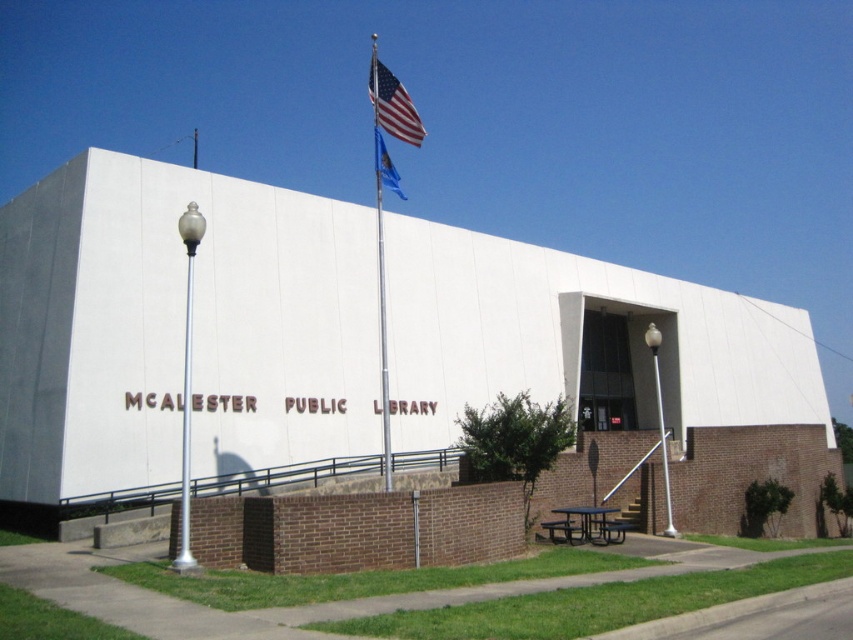
Is american flag at upper center shorter than blue fabric flag at upper center?

Incorrect, american flag at upper center's height does not fall short of blue fabric flag at upper center's.

Does american flag at upper center have a lesser width compared to blue fabric flag at upper center?

In fact, american flag at upper center might be wider than blue fabric flag at upper center.

Is point (399, 102) closer to viewer compared to point (381, 163)?

That is True.

Find the location of a particular element. The height and width of the screenshot is (640, 853). american flag at upper center is located at coordinates (393, 104).

Between silver metallic flag pole at upper center and blue fabric flag at upper center, which one is positioned higher?

silver metallic flag pole at upper center

Which is in front, point (381, 221) or point (396, 176)?

Positioned in front is point (381, 221).

Is point (384, 436) positioned behind point (379, 168)?

That is False.

Where is `silver metallic flag pole at upper center`? The image size is (853, 640). silver metallic flag pole at upper center is located at coordinates (381, 266).

Is point (376, 108) closer to viewer compared to point (178, 554)?

No.

Based on the photo, can you confirm if silver metallic flag pole at upper center is positioned above silver metallic pole at left?

Indeed, silver metallic flag pole at upper center is positioned over silver metallic pole at left.

I want to click on silver metallic flag pole at upper center, so click(x=381, y=266).

This screenshot has height=640, width=853. I want to click on silver metallic flag pole at upper center, so click(x=381, y=266).